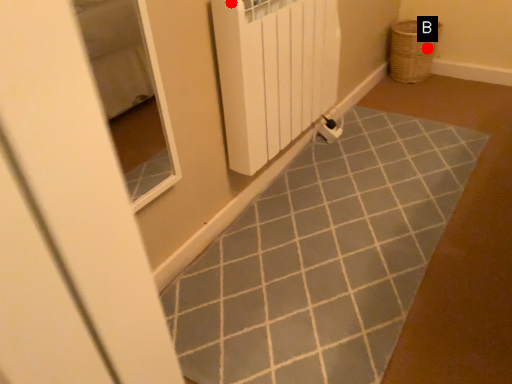
Question: Two points are circled on the image, labeled by A and B beside each circle. Among these points, which one is farthest from the camera?

Choices:
 (A) A is further
 (B) B is further

Answer: (B)